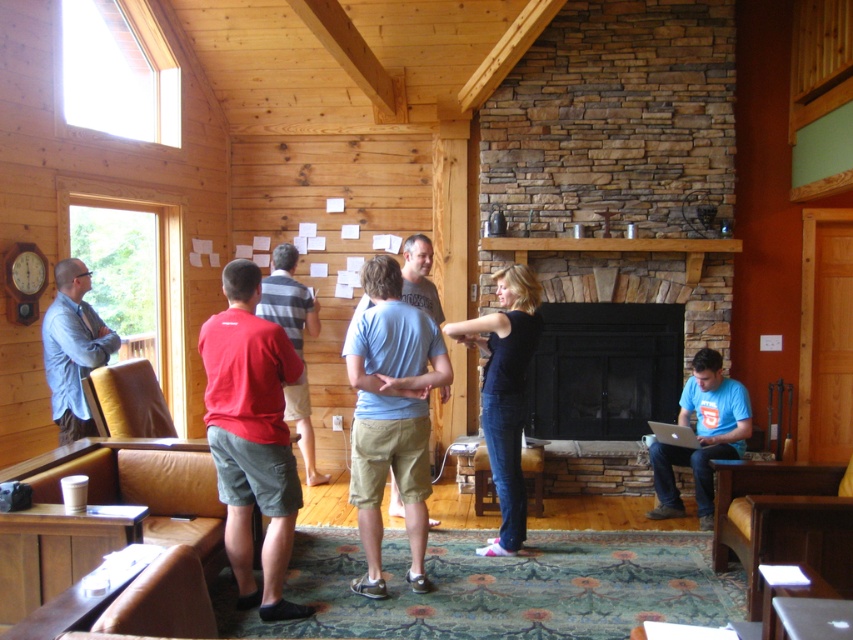
You are standing at point (312,452) and want to walk to the fireplace. There is an obstacle at point (225,264). Will you be able to reach the fireplace without passing the obstacle?

Point (225,264) is in front of point (312,452), so the obstacle is blocking the path to the fireplace. You will need to go around it to reach the fireplace.

You are standing in the cabin and want to hand a gift to the person wearing the light blue cotton shirt at center. Based on the coordinates provided, in which general direction should you move to reach them?

The light blue cotton shirt at center is located at point coordinates, so you should move towards the center of the room to reach them.